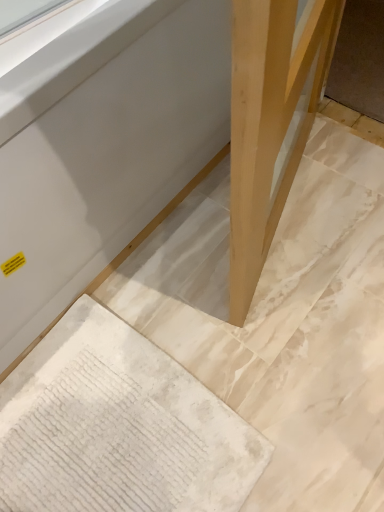
Question: Is point (107, 260) positioned closer to the camera than point (96, 479)?

Choices:
 (A) farther
 (B) closer

Answer: (A)

Question: From the image's perspective, is matte wood table at center located above or below white textured rug at lower left?

Choices:
 (A) below
 (B) above

Answer: (B)

Question: Considering the real-world distances, which object is farthest from the matte wood table at center?

Choices:
 (A) natural wood leg at center
 (B) white textured rug at lower left

Answer: (B)

Question: Estimate the real-world distances between objects in this image. Which object is farther from the natural wood leg at center?

Choices:
 (A) white textured rug at lower left
 (B) matte wood table at center

Answer: (A)